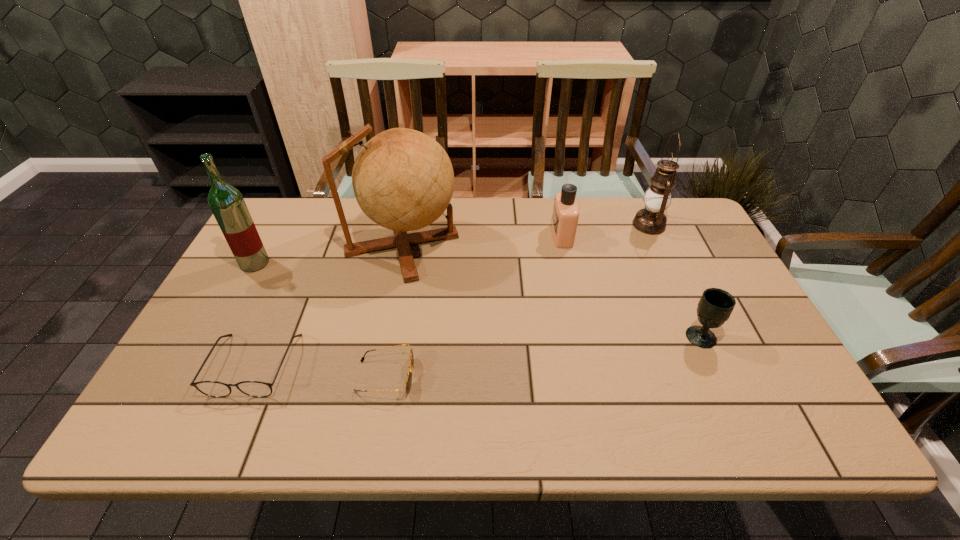
This screenshot has height=540, width=960. Identify the location of globe. (403, 180).

This screenshot has width=960, height=540. I want to click on liquor, so click(x=226, y=202).

The width and height of the screenshot is (960, 540). I want to click on oil lamp, so click(x=651, y=220).

You are a GUI agent. You are given a task and a screenshot of the screen. Output one action in this format:
    pyautogui.click(x=<x>, y=<y>)
    Task: Click on the perfume
    The image size is (960, 540).
    Given the screenshot: What is the action you would take?
    pyautogui.click(x=565, y=216)

Locate an element on the screen. The width and height of the screenshot is (960, 540). the third object from right to left is located at coordinates (565, 216).

The height and width of the screenshot is (540, 960). Find the location of `the fifth tallest object`. the fifth tallest object is located at coordinates (714, 308).

What are the coordinates of `the second shortest object` in the screenshot? It's located at (217, 389).

In order to click on the sixth object from right to left in this screenshot , I will do `click(217, 389)`.

Locate an element on the screen. Image resolution: width=960 pixels, height=540 pixels. sunglasses is located at coordinates (409, 375).

The image size is (960, 540). Find the location of `free region located on the surface of the globe`. free region located on the surface of the globe is located at coordinates (524, 244).